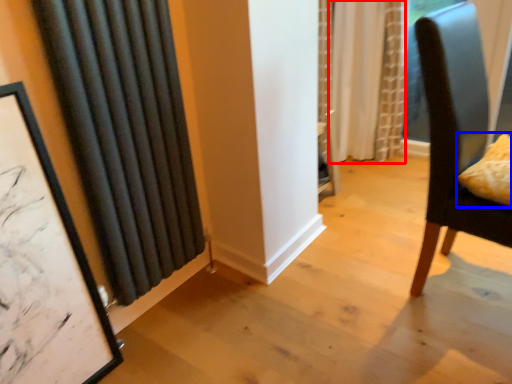
Question: Which object is further to the camera taking this photo, curtain (highlighted by a red box) or pillow (highlighted by a blue box)?

Choices:
 (A) curtain
 (B) pillow

Answer: (A)